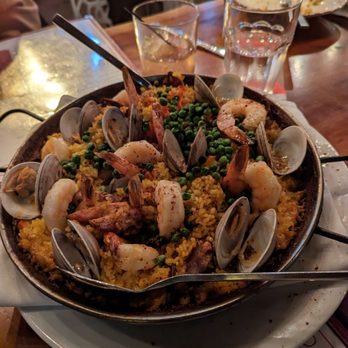
Where is `napkin`? This screenshot has width=348, height=348. napkin is located at coordinates (14, 289).